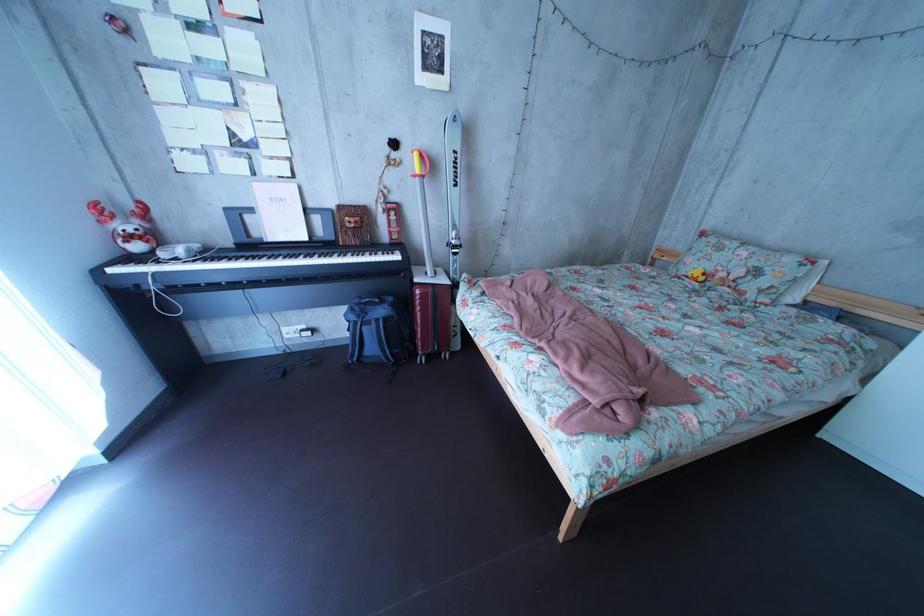
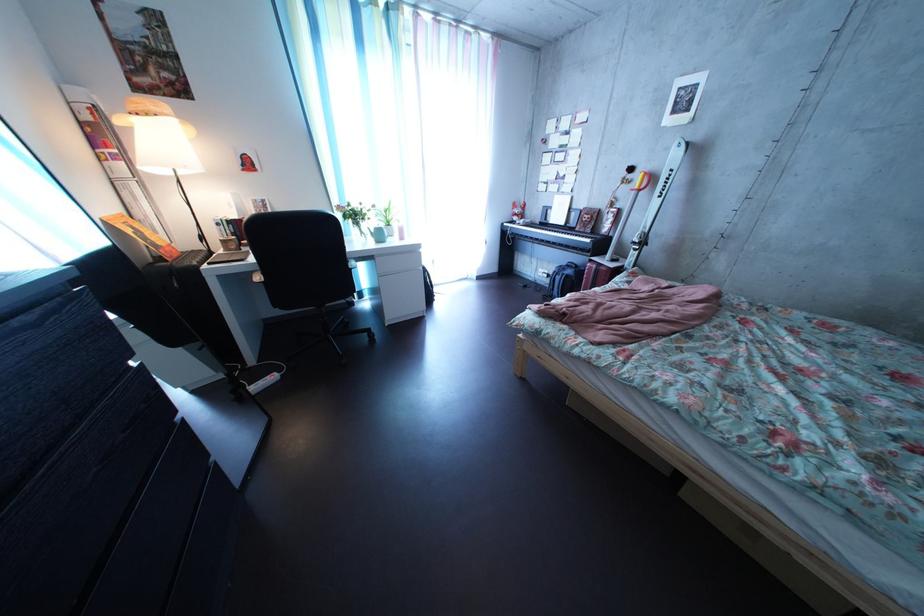
The point at (280, 328) is marked in the first image. Where is the corresponding point in the second image?

(550, 269)